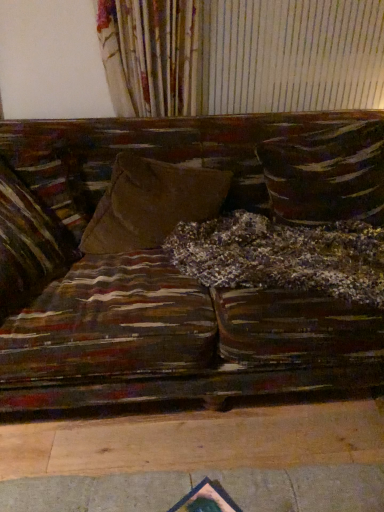
Question: Is point tap(170, 193) closer or farther from the camera than point tap(362, 186)?

Choices:
 (A) closer
 (B) farther

Answer: (A)

Question: Based on their sizes in the image, would you say suede-like brown pillow at center, the second pillow when ordered from right to left, is bigger or smaller than textured brown pillow at center, the 3th pillow positioned from the left?

Choices:
 (A) small
 (B) big

Answer: (A)

Question: Considering the real-world distances, which object is farthest from the suede-like brown pillow at center, the second pillow when ordered from right to left?

Choices:
 (A) textured brown pillow at center, the 3th pillow positioned from the left
 (B) velvet brown pillow at left, the 1th pillow positioned from the left

Answer: (A)

Question: Which is nearer to the velvet brown pillow at left, the 1th pillow positioned from the left?

Choices:
 (A) suede-like brown pillow at center, the second pillow when ordered from right to left
 (B) textured brown pillow at center, the 1th pillow in the right-to-left sequence

Answer: (A)